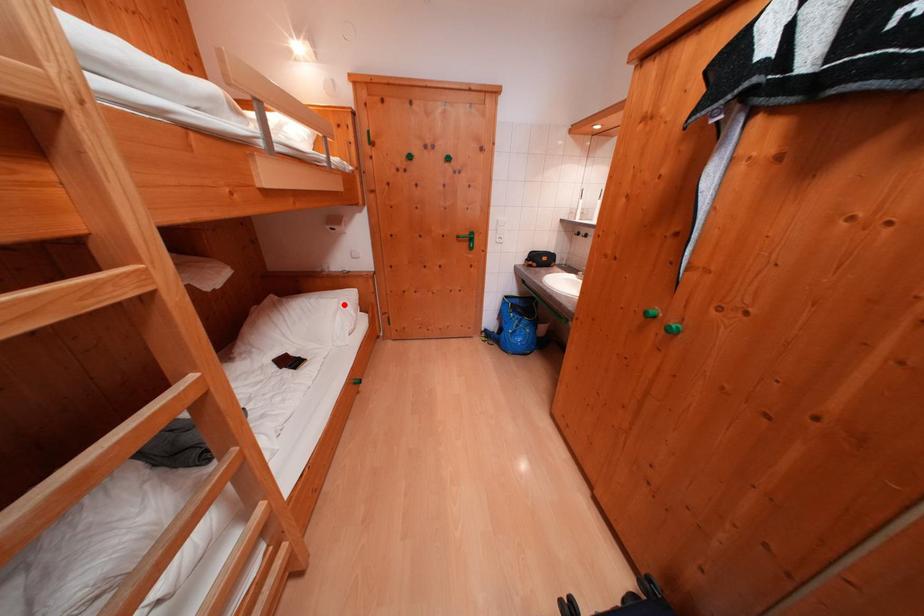
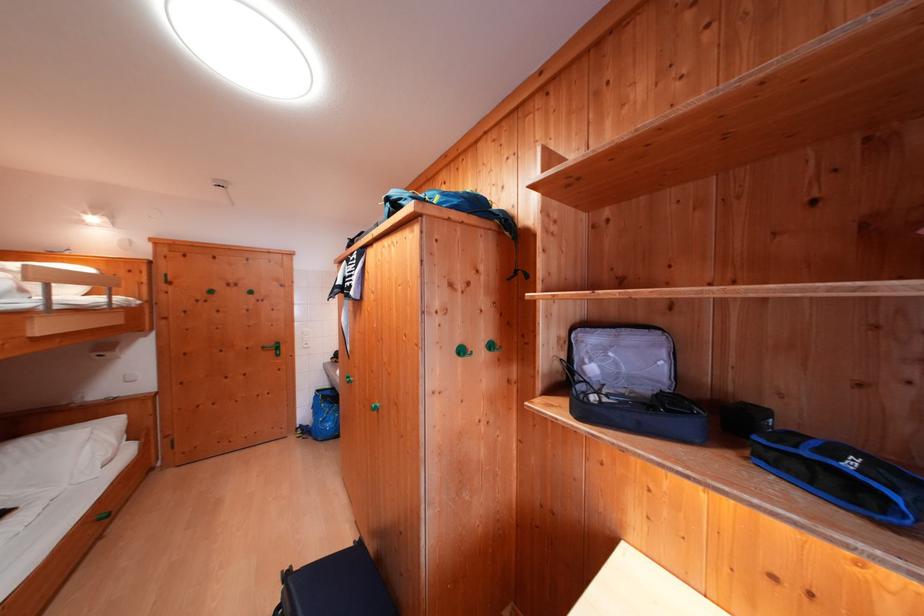
Locate, in the second image, the point that corresponds to the highlighted location in the first image.

(96, 434)